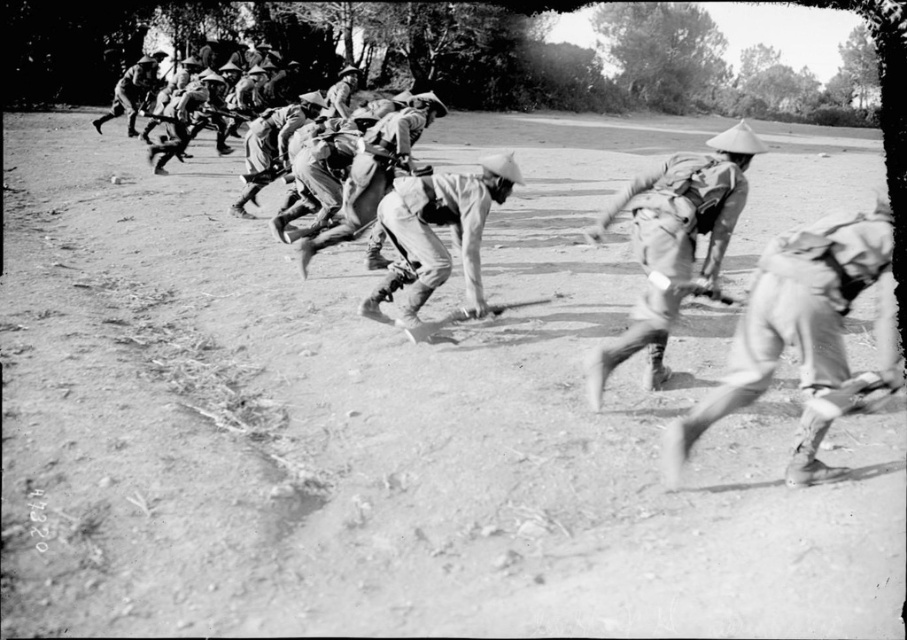
Is light brown uniform at center wider than light gray uniform at center?

Correct, the width of light brown uniform at center exceeds that of light gray uniform at center.

Between light brown uniform at center and light gray uniform at center, which one is positioned lower?

light brown uniform at center is lower down.

Image resolution: width=907 pixels, height=640 pixels. In order to click on light brown uniform at center in this screenshot , I will do `click(674, 243)`.

You are a GUI agent. You are given a task and a screenshot of the screen. Output one action in this format:
    pyautogui.click(x=<x>, y=<y>)
    Task: Click on the light brown uniform at center
    
    Given the screenshot: What is the action you would take?
    pyautogui.click(x=674, y=243)

Is point (714, 170) in front of point (264, 161)?

Yes, it is in front of point (264, 161).

Where is `light brown uniform at center`? light brown uniform at center is located at coordinates (674, 243).

Is rough canvas uniform at center below light brown uniform at upper left?

Yes, rough canvas uniform at center is below light brown uniform at upper left.

Is rough canvas uniform at center positioned behind light brown uniform at upper left?

No, it is in front of light brown uniform at upper left.

Who is more distant from viewer, (286, 148) or (125, 108)?

The point (125, 108) is more distant.

You are a GUI agent. You are given a task and a screenshot of the screen. Output one action in this format:
    pyautogui.click(x=<x>, y=<y>)
    Task: Click on the rough canvas uniform at center
    The width and height of the screenshot is (907, 640).
    Given the screenshot: What is the action you would take?
    pyautogui.click(x=271, y=145)